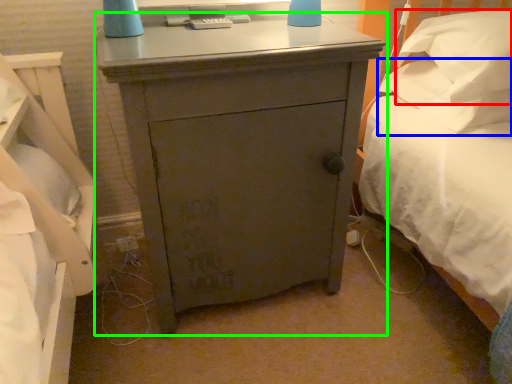
Question: Which object is positioned closest to pillow (highlighted by a red box)? Select from pillow (highlighted by a blue box) and nightstand (highlighted by a green box).

Choices:
 (A) pillow
 (B) nightstand

Answer: (A)